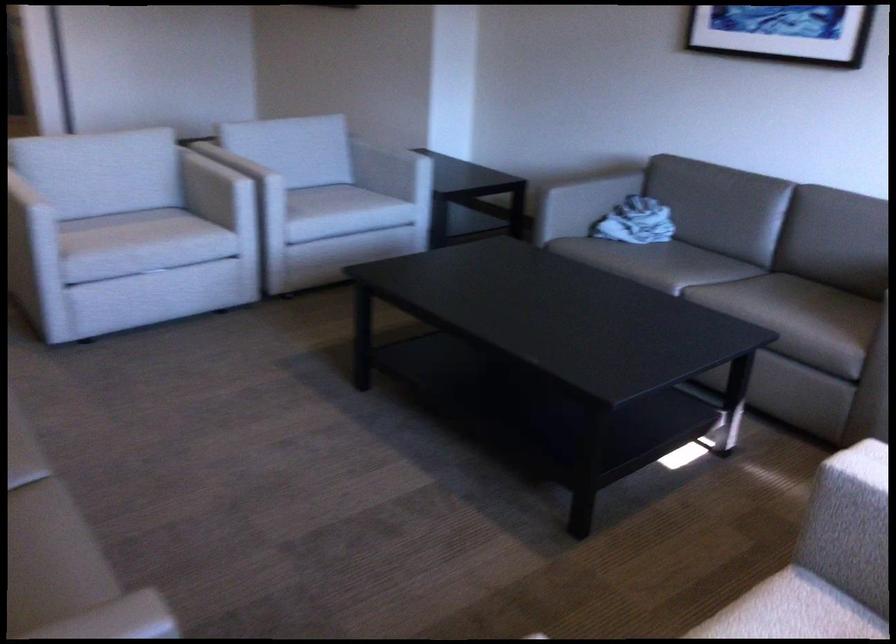
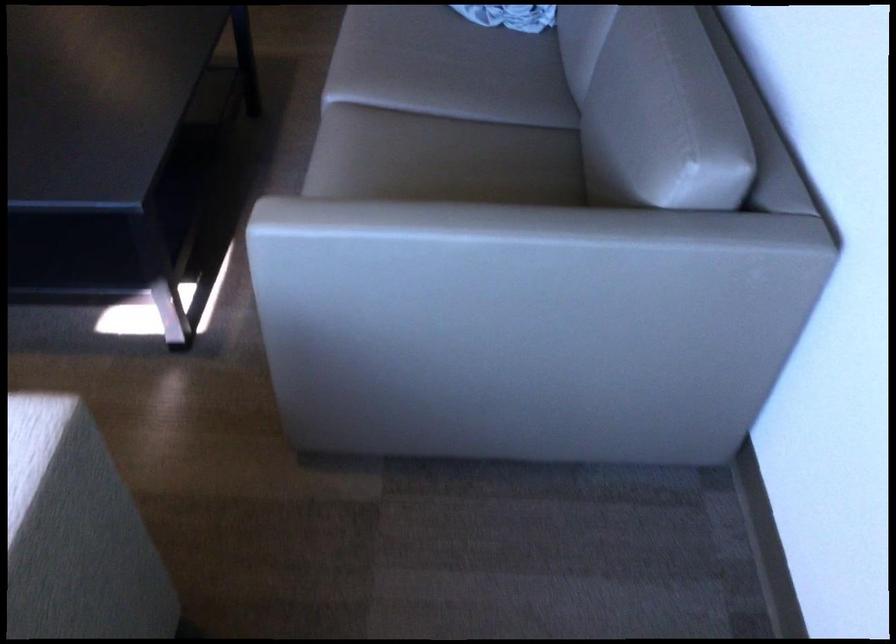
Find the pixel in the second image that matches pixel 684 263 in the first image.

(463, 73)